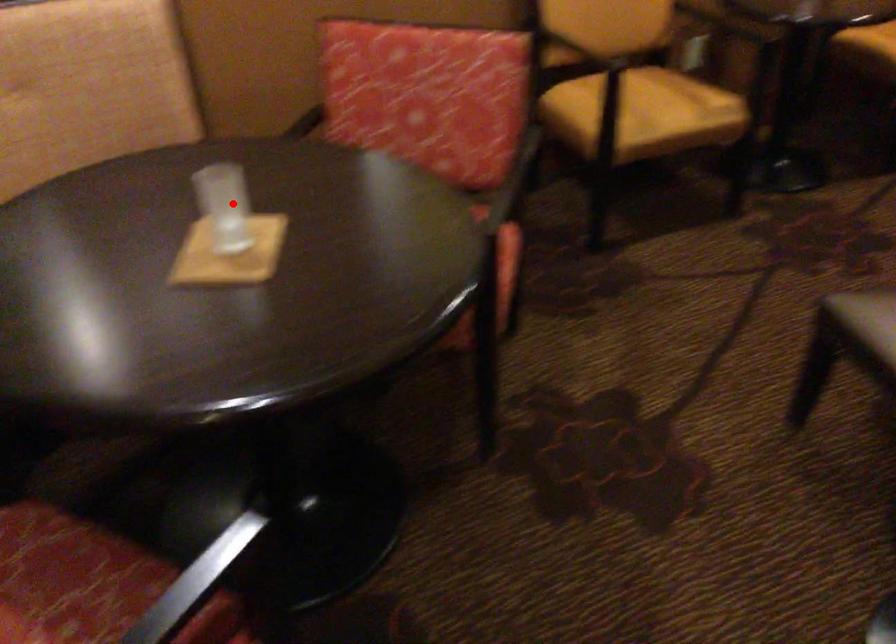
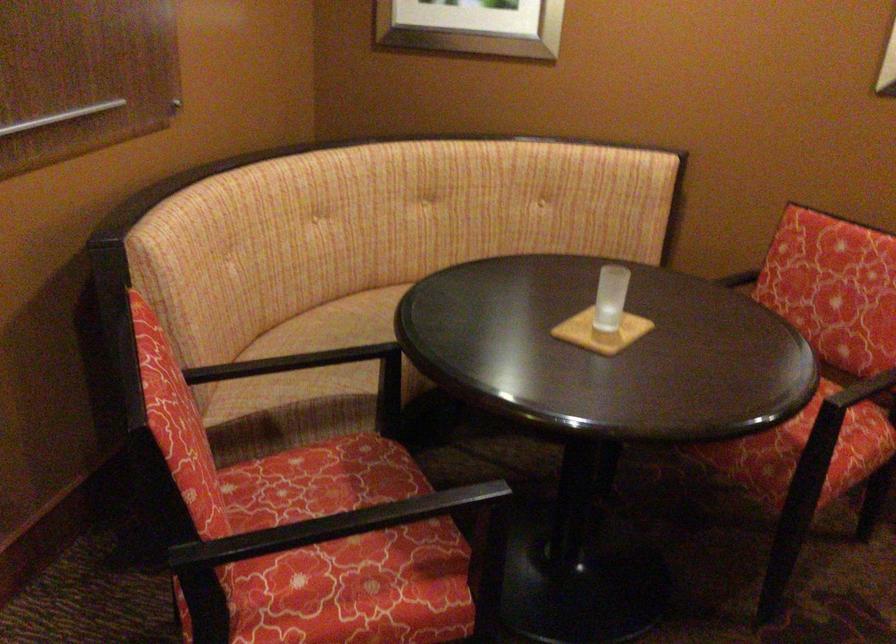
The point at the highlighted location is marked in the first image. Where is the corresponding point in the second image?

(609, 297)